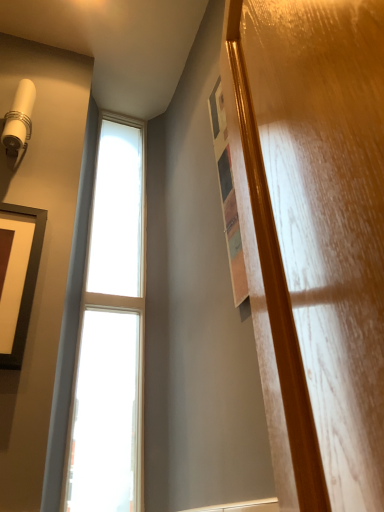
Question: Relative to clear glass window at left, is matte black picture frame at left in front or behind?

Choices:
 (A) behind
 (B) front

Answer: (B)

Question: From the image's perspective, relative to clear glass window at left, is matte black picture frame at left above or below?

Choices:
 (A) below
 (B) above

Answer: (A)

Question: Visually, is matte black picture frame at left positioned to the left or to the right of clear glass window at left?

Choices:
 (A) right
 (B) left

Answer: (B)

Question: From the image's perspective, is clear glass window at left located above or below matte black picture frame at left?

Choices:
 (A) above
 (B) below

Answer: (A)

Question: Which is correct: clear glass window at left is inside matte black picture frame at left, or outside of it?

Choices:
 (A) outside
 (B) inside

Answer: (A)

Question: From their relative heights in the image, would you say clear glass window at left is taller or shorter than matte black picture frame at left?

Choices:
 (A) short
 (B) tall

Answer: (B)

Question: Considering the relative positions of clear glass window at left and matte black picture frame at left in the image provided, is clear glass window at left to the left or to the right of matte black picture frame at left?

Choices:
 (A) left
 (B) right

Answer: (B)